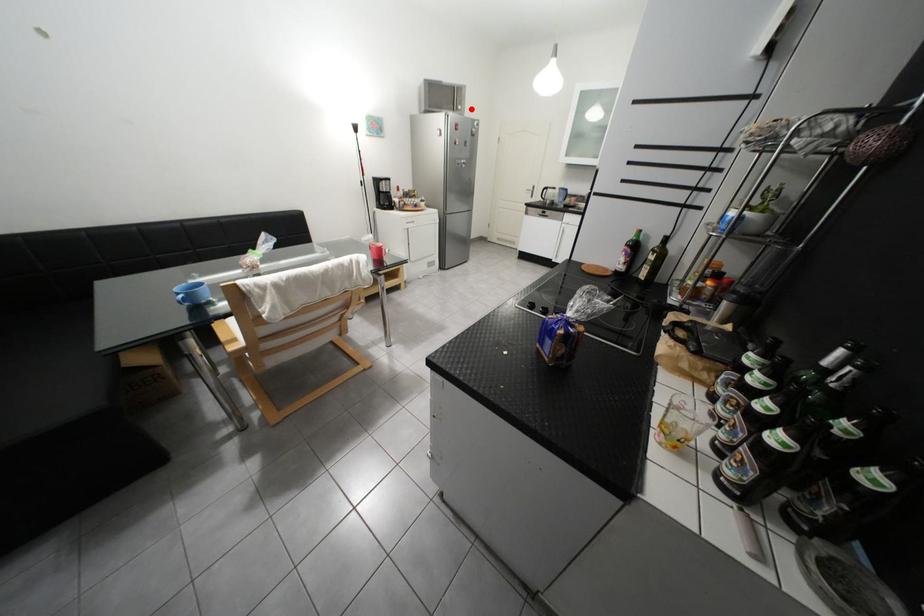
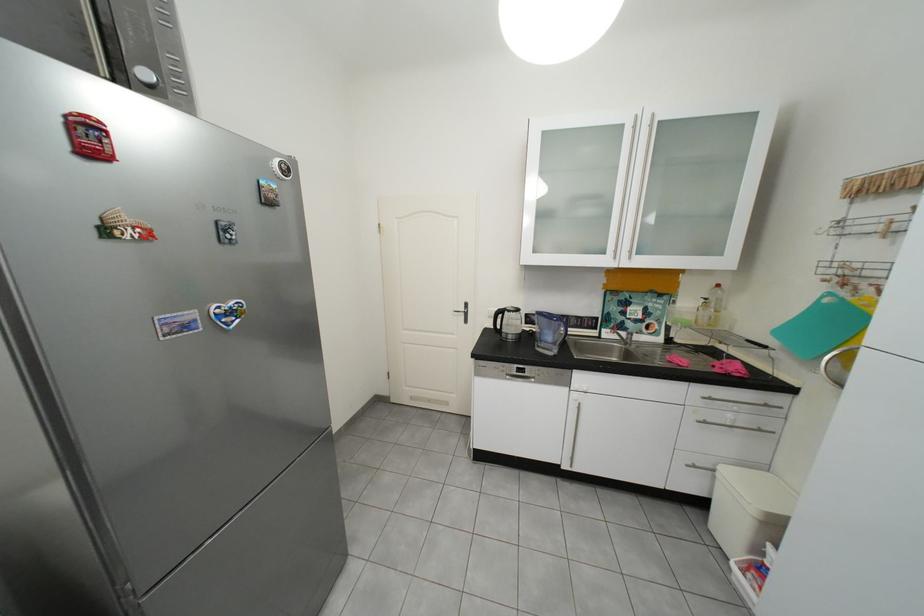
Question: I am providing you with two images of the same scene from different viewpoints. A red point is shown in image1. For the corresponding object point in image2, is it positioned nearer or farther from the camera?

Choices:
 (A) Nearer
 (B) Farther

Answer: (B)